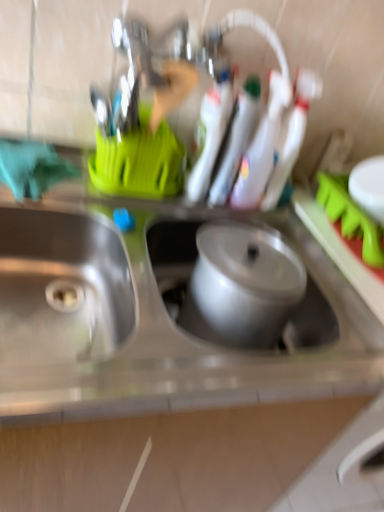
Question: Does stainless steel sink at left, the second sink in the right-to-left sequence, have a larger size compared to metallic silver pot at center, which is the first sink from right to left?

Choices:
 (A) yes
 (B) no

Answer: (A)

Question: Could metallic silver pot at center, acting as the second sink starting from the left, be considered to be inside stainless steel sink at left, the second sink in the right-to-left sequence?

Choices:
 (A) no
 (B) yes

Answer: (A)

Question: Is stainless steel sink at left, the second sink in the right-to-left sequence, smaller than metallic silver pot at center, acting as the second sink starting from the left?

Choices:
 (A) no
 (B) yes

Answer: (A)

Question: From the image's perspective, is stainless steel sink at left, the second sink in the right-to-left sequence, on metallic silver pot at center, which is the first sink from right to left?

Choices:
 (A) no
 (B) yes

Answer: (A)

Question: From a real-world perspective, is stainless steel sink at left, arranged as the 1th sink when viewed from the left, positioned over metallic silver pot at center, acting as the second sink starting from the left, based on gravity?

Choices:
 (A) yes
 (B) no

Answer: (B)

Question: Considering the relative sizes of stainless steel sink at left, arranged as the 1th sink when viewed from the left, and metallic silver pot at center, which is the first sink from right to left, in the image provided, is stainless steel sink at left, arranged as the 1th sink when viewed from the left, shorter than metallic silver pot at center, which is the first sink from right to left,?

Choices:
 (A) yes
 (B) no

Answer: (B)

Question: Is metallic silver pot at center, acting as the second sink starting from the left, at the left side of stainless steel sink at left, arranged as the 1th sink when viewed from the left?

Choices:
 (A) no
 (B) yes

Answer: (A)

Question: From the image's perspective, is metallic silver pot at center, which is the first sink from right to left, above stainless steel sink at left, arranged as the 1th sink when viewed from the left?

Choices:
 (A) no
 (B) yes

Answer: (B)

Question: From a real-world perspective, is metallic silver pot at center, acting as the second sink starting from the left, located higher than stainless steel sink at left, the second sink in the right-to-left sequence?

Choices:
 (A) no
 (B) yes

Answer: (B)

Question: Does metallic silver pot at center, which is the first sink from right to left, have a lesser height compared to stainless steel sink at left, the second sink in the right-to-left sequence?

Choices:
 (A) no
 (B) yes

Answer: (B)

Question: Is the surface of metallic silver pot at center, which is the first sink from right to left, in direct contact with stainless steel sink at left, the second sink in the right-to-left sequence?

Choices:
 (A) no
 (B) yes

Answer: (A)

Question: Can you confirm if metallic silver pot at center, acting as the second sink starting from the left, is wider than stainless steel sink at left, arranged as the 1th sink when viewed from the left?

Choices:
 (A) yes
 (B) no

Answer: (B)

Question: Is stainless steel sink at left, arranged as the 1th sink when viewed from the left, bigger or smaller than metallic silver pot at center, which is the first sink from right to left?

Choices:
 (A) big
 (B) small

Answer: (A)